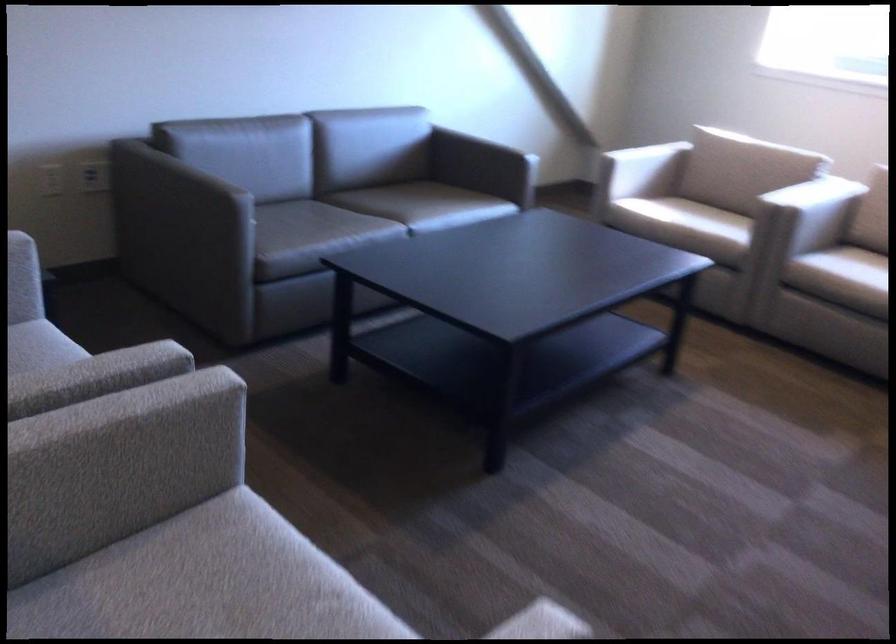
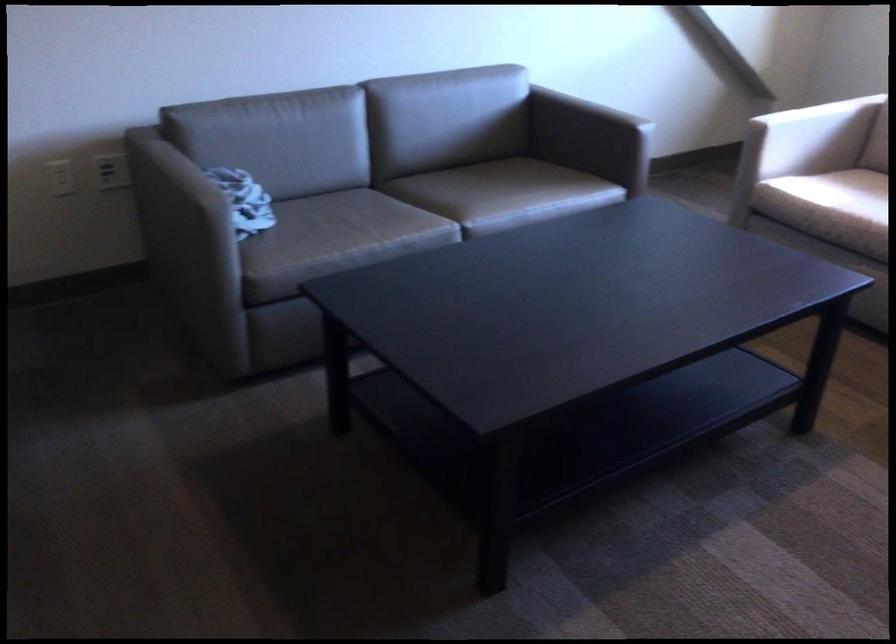
The point at (x=659, y=223) is marked in the first image. Where is the corresponding point in the second image?

(821, 216)